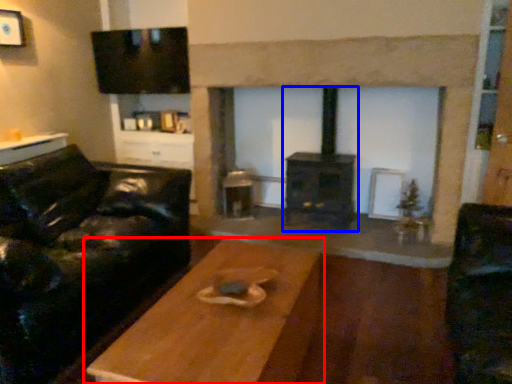
Question: Which object is closer to the camera taking this photo, table (highlighted by a red box) or wood burning stove (highlighted by a blue box)?

Choices:
 (A) table
 (B) wood burning stove

Answer: (A)